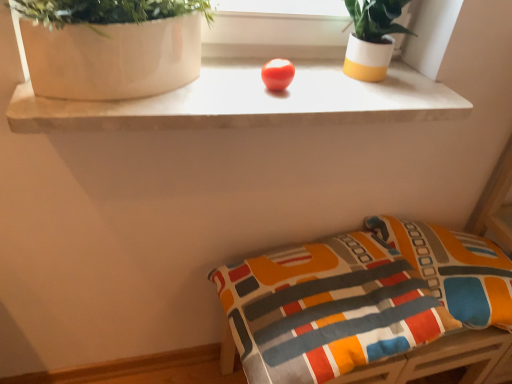
Where is `vacant space underneath white glossy vase at upper left (from a real-world perspective)`? This screenshot has height=384, width=512. vacant space underneath white glossy vase at upper left (from a real-world perspective) is located at coordinates (120, 97).